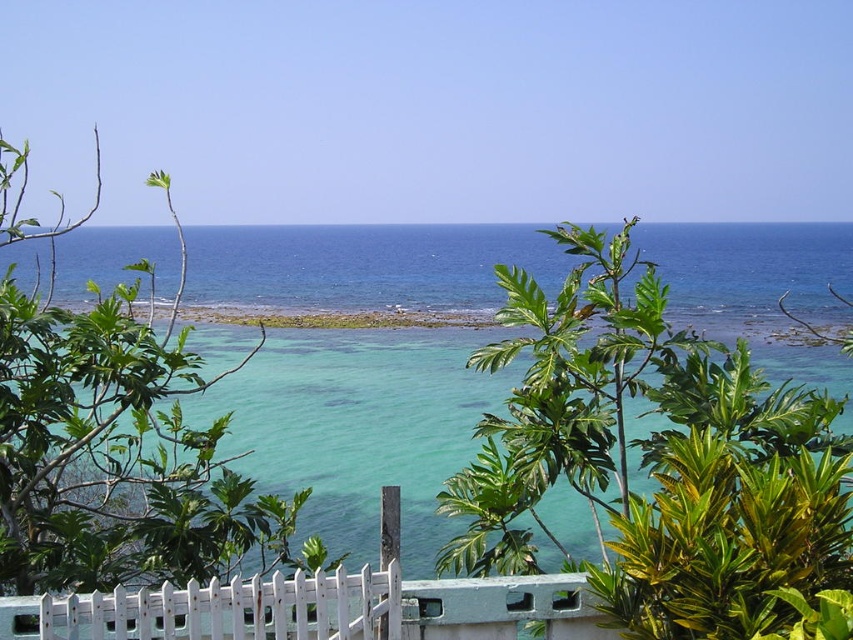
Which is more to the right, clear blue water at center or white painted wood fence at center?

From the viewer's perspective, white painted wood fence at center appears more on the right side.

Which is more to the left, clear blue water at center or white painted wood fence at center?

clear blue water at center is more to the left.

Is point (263, 484) less distant than point (146, 621)?

No, it is not.

The width and height of the screenshot is (853, 640). What are the coordinates of `clear blue water at center` in the screenshot? It's located at (361, 426).

Can you confirm if green leafy plant at upper left is smaller than clear sand at center?

No, green leafy plant at upper left is not smaller than clear sand at center.

How distant is green leafy plant at upper left from clear sand at center?

green leafy plant at upper left is 54.31 feet away from clear sand at center.

At what (x,y) coordinates should I click in order to perform the action: click on green leafy plant at upper left. Please return your answer as a coordinate pair (x, y). Looking at the image, I should click on (117, 456).

At what (x,y) coordinates should I click in order to perform the action: click on green leafy plant at upper left. Please return your answer as a coordinate pair (x, y). The image size is (853, 640). Looking at the image, I should click on pos(117,456).

Is white painted wood fence at center behind clear sand at center?

No, white painted wood fence at center is closer to the viewer.

Who is taller, white painted wood fence at center or clear sand at center?

With more height is clear sand at center.

This screenshot has height=640, width=853. What do you see at coordinates (177, 612) in the screenshot? I see `white painted wood fence at center` at bounding box center [177, 612].

Find the location of a particular element. white painted wood fence at center is located at coordinates (177, 612).